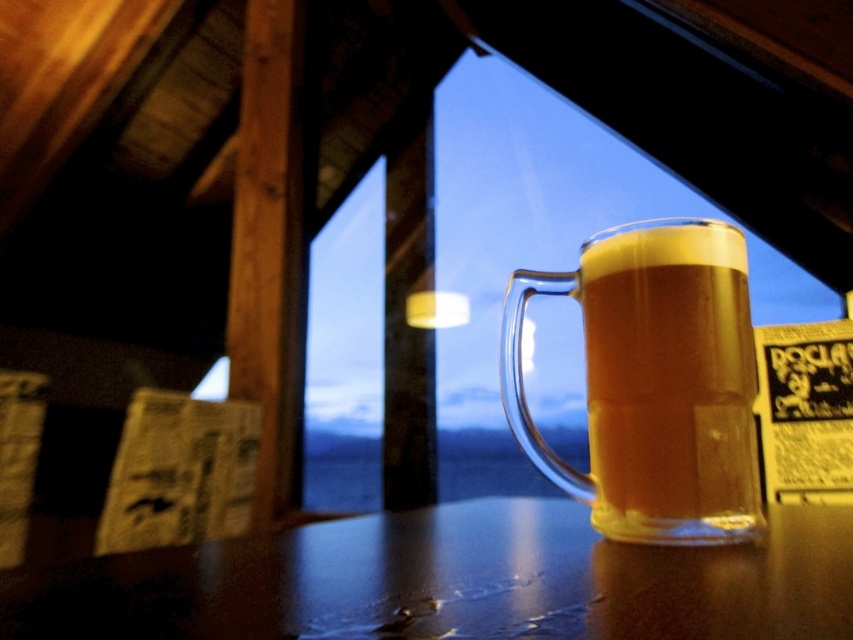
Does point (331, 547) come in front of point (577, 291)?

That is True.

Which is more to the left, shiny brown table at center or translucent glass mug at center?

shiny brown table at center

Which is in front, point (498, 570) or point (672, 531)?

Point (498, 570)

Image resolution: width=853 pixels, height=640 pixels. What are the coordinates of `shiny brown table at center` in the screenshot? It's located at (453, 582).